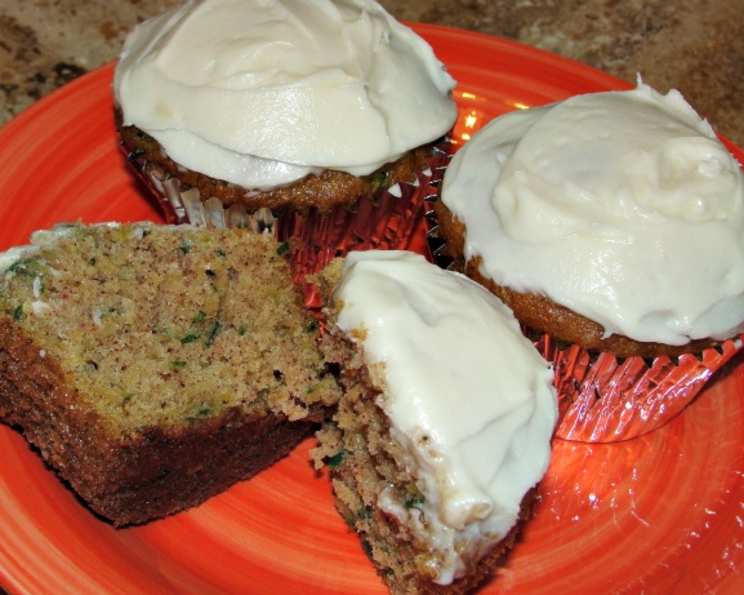
Image resolution: width=744 pixels, height=595 pixels. In order to click on orange plate in this screenshot , I will do pos(705,496), pos(301,565), pos(513,54).